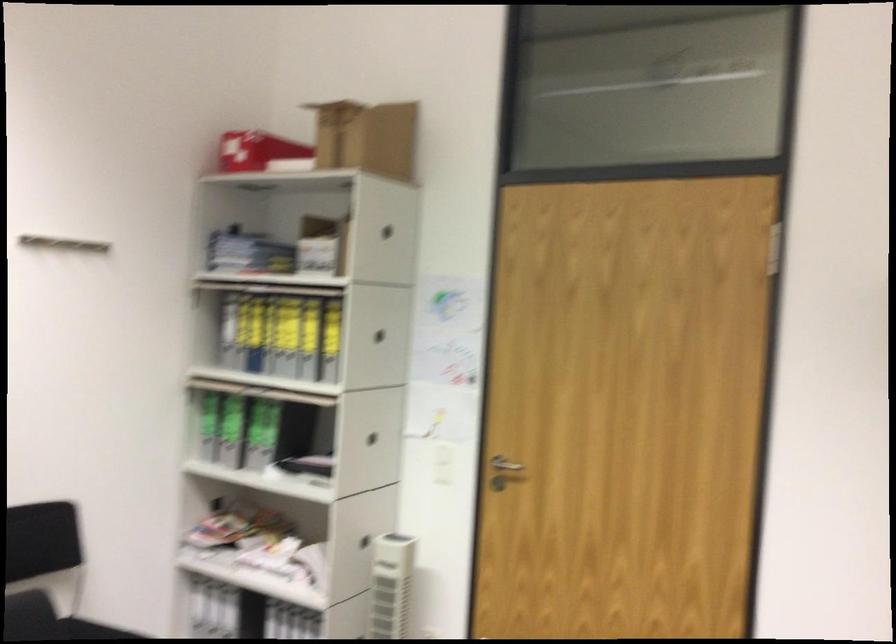
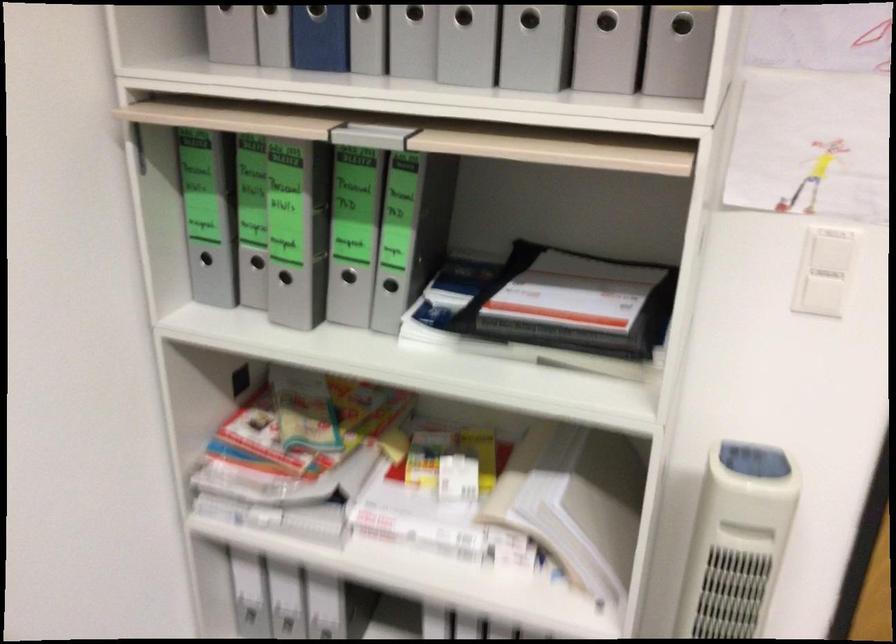
In the second image, find the point that corresponds to point (364, 357) in the first image.

(682, 24)